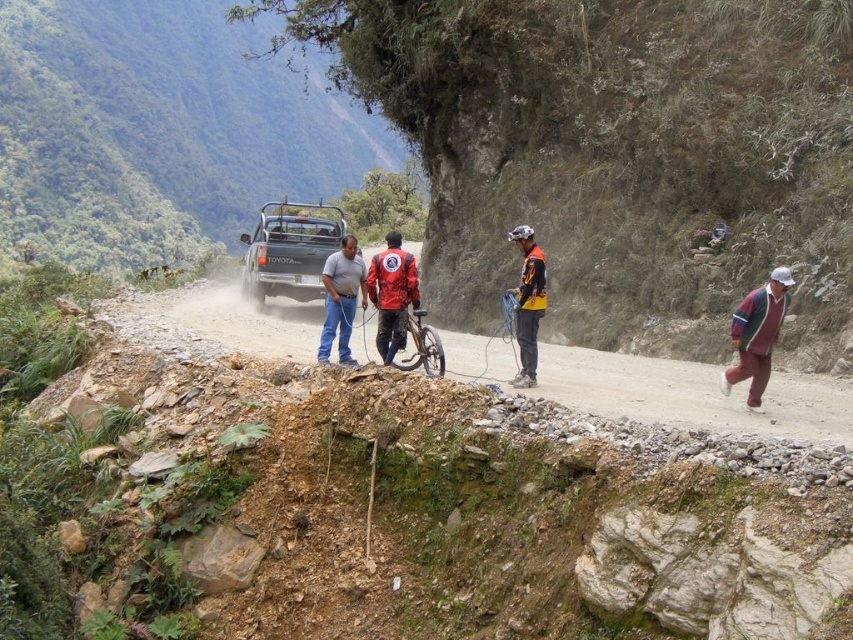
Question: Is green matte truck at center below matte blue jeans at center?

Choices:
 (A) yes
 (B) no

Answer: (B)

Question: Which point is farther from the camera taking this photo?

Choices:
 (A) (529, 285)
 (B) (386, 337)
 (C) (776, 296)
 (D) (432, 340)

Answer: (B)

Question: Does green grassy hillside at upper left appear on the right side of orange fabric helmet at center?

Choices:
 (A) no
 (B) yes

Answer: (A)

Question: Which of the following is the farthest from the observer?

Choices:
 (A) orange fabric helmet at center
 (B) striped sweater at right
 (C) matte blue jeans at center

Answer: (C)

Question: Considering the real-world distances, which object is farthest from the orange fabric helmet at center?

Choices:
 (A) striped sweater at right
 (B) shiny metallic bicycle at center

Answer: (A)

Question: Is the position of green matte truck at center less distant than that of red matte jacket at center?

Choices:
 (A) yes
 (B) no

Answer: (B)